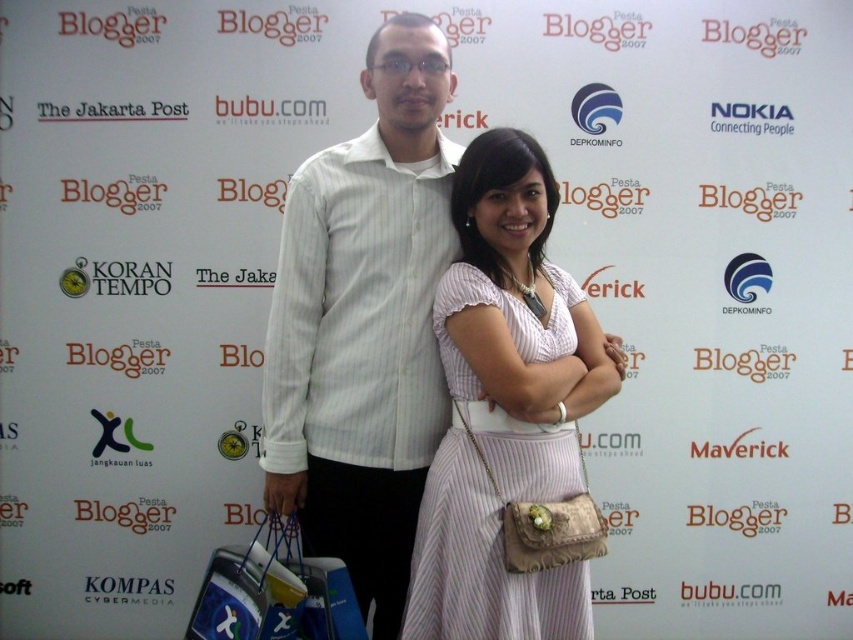
Question: Does white striped dress at center come in front of blue fabric shopping bag at lower left?

Choices:
 (A) no
 (B) yes

Answer: (B)

Question: Considering the real-world distances, which object is farthest from the white striped shirt at center?

Choices:
 (A) white striped dress at center
 (B) blue fabric shopping bag at lower left

Answer: (B)

Question: Which point is farther from the camera taking this photo?

Choices:
 (A) (445, 54)
 (B) (322, 573)

Answer: (A)

Question: Is white striped shirt at center below white striped dress at center?

Choices:
 (A) no
 (B) yes

Answer: (A)

Question: Which object is farther from the camera taking this photo?

Choices:
 (A) white striped dress at center
 (B) blue fabric shopping bag at lower left

Answer: (B)

Question: Does white striped shirt at center have a greater width compared to white striped dress at center?

Choices:
 (A) no
 (B) yes

Answer: (B)